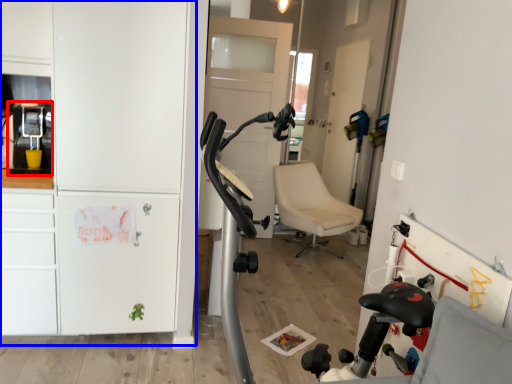
Question: Among these objects, which one is farthest to the camera, appliance (highlighted by a red box) or dresser (highlighted by a blue box)?

Choices:
 (A) appliance
 (B) dresser

Answer: (A)